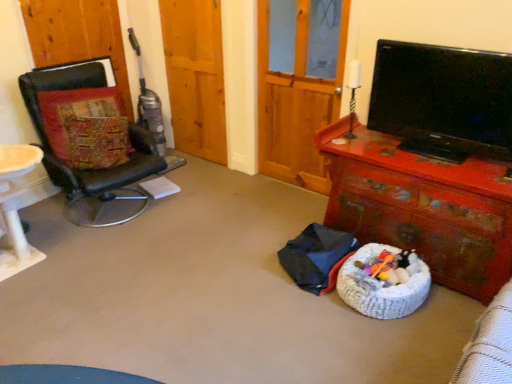
The height and width of the screenshot is (384, 512). Find the location of `vacant space positioned to the left of white woven dog bed at lower center`. vacant space positioned to the left of white woven dog bed at lower center is located at coordinates (311, 314).